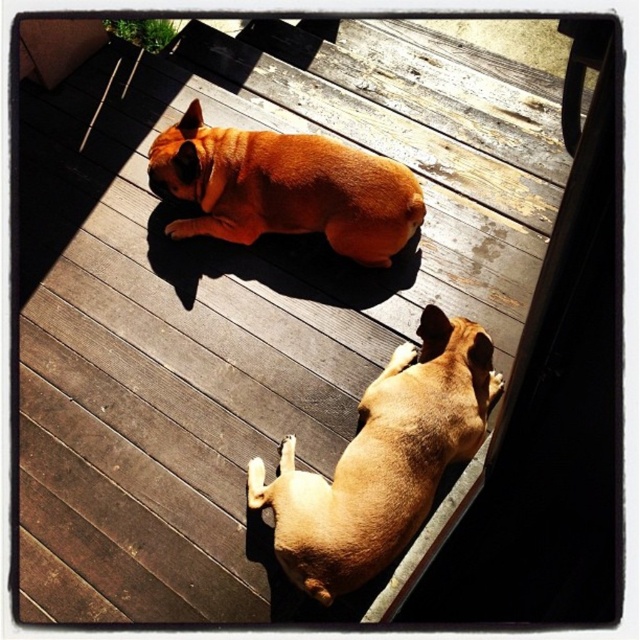
Question: Does light brown fur at lower right appear under matte orange dog at center?

Choices:
 (A) no
 (B) yes

Answer: (B)

Question: Does light brown fur at lower right have a larger size compared to matte orange dog at center?

Choices:
 (A) yes
 (B) no

Answer: (A)

Question: Observing the image, what is the correct spatial positioning of light brown fur at lower right in reference to matte orange dog at center?

Choices:
 (A) above
 (B) below

Answer: (B)

Question: Which of the following is the closest to the observer?

Choices:
 (A) light brown fur at lower right
 (B) matte orange dog at center

Answer: (A)